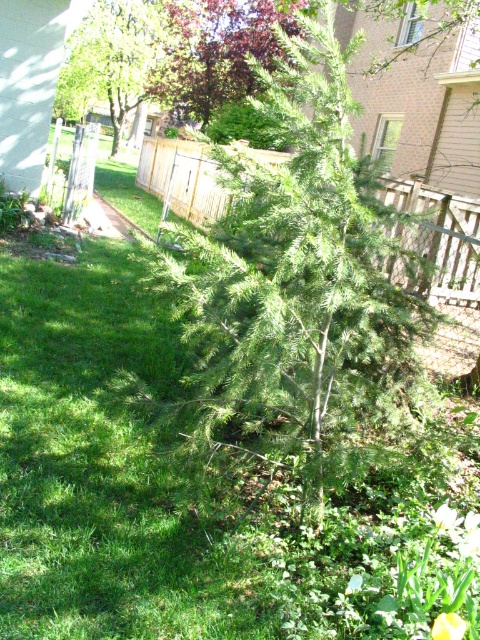
Is green needle-like tree at center below green leafy tree at upper left?

Indeed, green needle-like tree at center is positioned under green leafy tree at upper left.

Which is behind, point (367, 365) or point (129, 88)?

Point (129, 88)

Who is more forward, [309,109] or [72,58]?

Point [309,109] is in front.

The height and width of the screenshot is (640, 480). I want to click on green needle-like tree at center, so click(x=300, y=289).

Which is in front, point (283, 260) or point (450, 524)?

Point (283, 260) is more forward.

Does point (315, 148) come farther from viewer compared to point (445, 506)?

No, (315, 148) is closer to viewer.

The width and height of the screenshot is (480, 640). I want to click on green needle-like tree at center, so click(x=300, y=289).

Who is more forward, (96, 67) or (454, 518)?

Point (454, 518)

Between green leafy tree at upper left and yellow matte flower at lower right, which one is positioned higher?

green leafy tree at upper left

The image size is (480, 640). I want to click on green leafy tree at upper left, so click(x=120, y=60).